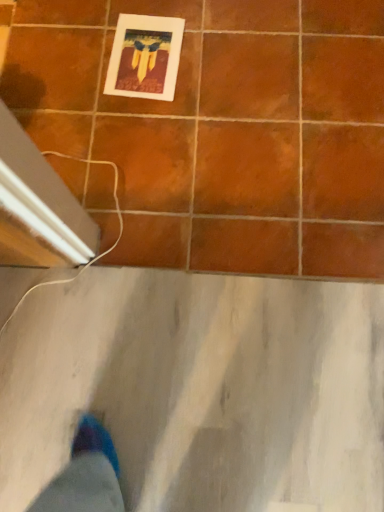
The width and height of the screenshot is (384, 512). What do you see at coordinates (201, 389) in the screenshot?
I see `smooth concrete at bottom` at bounding box center [201, 389].

Locate an element on the screen. The image size is (384, 512). smooth concrete at bottom is located at coordinates (201, 389).

Find the location of `smooth concrete at bottom`. smooth concrete at bottom is located at coordinates (201, 389).